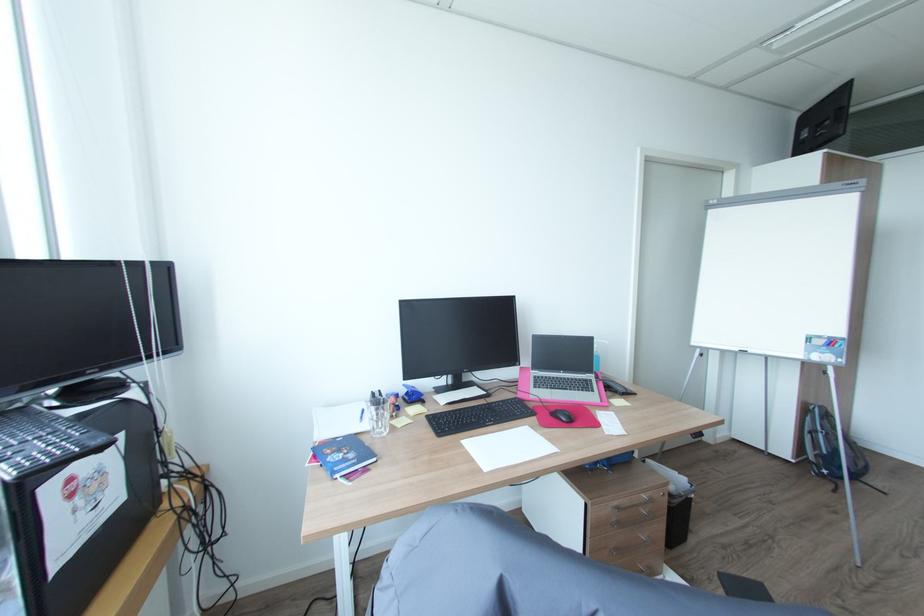
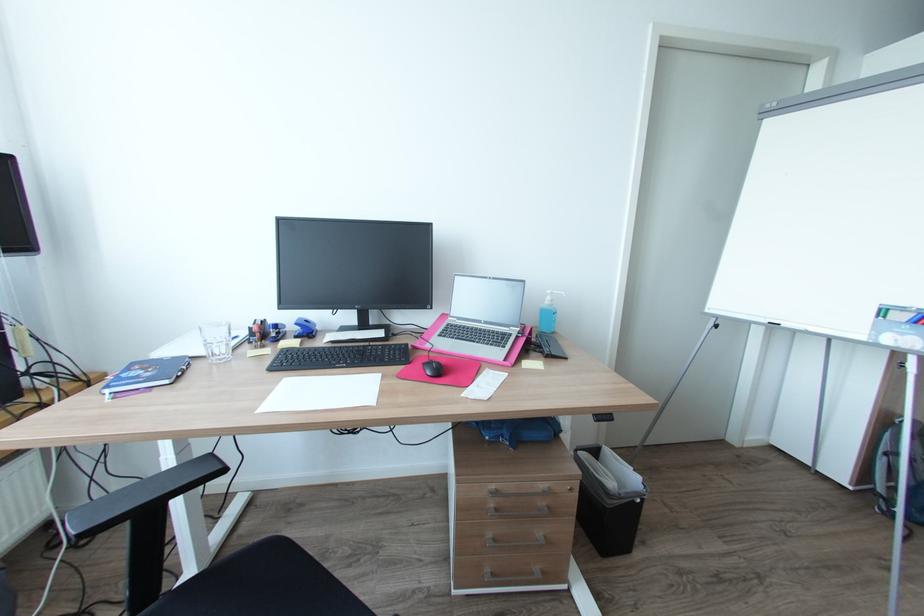
Question: The camera is either moving clockwise (left) or counter-clockwise (right) around the object. The first image is from the beginning of the video and the second image is from the end. Is the camera moving left or right when shooting the video?

Choices:
 (A) Left
 (B) Right

Answer: (B)